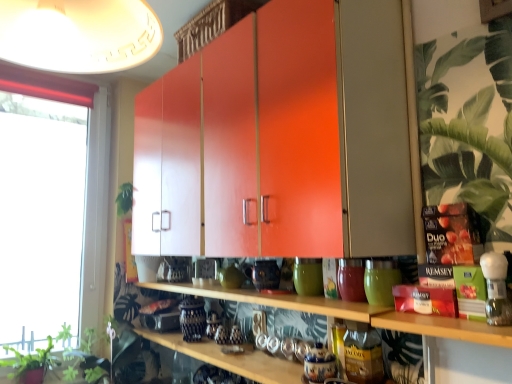
Question: Is green leafy plant at lower left, acting as the 3th plant starting from the top, located within green matte glass at center, acting as the 3th pottery starting from the back?

Choices:
 (A) no
 (B) yes

Answer: (A)

Question: Considering the relative sizes of green matte glass at center, which is the 3th pottery in left-to-right order, and green leafy plant at lower left, which is counted as the 3th plant, starting from the right, in the image provided, is green matte glass at center, which is the 3th pottery in left-to-right order, thinner than green leafy plant at lower left, which is counted as the 3th plant, starting from the right,?

Choices:
 (A) yes
 (B) no

Answer: (A)

Question: Can you confirm if green matte glass at center, the 1th pottery viewed from the right, is shorter than green leafy plant at lower left, which ranks as the first plant in bottom-to-top order?

Choices:
 (A) yes
 (B) no

Answer: (A)

Question: Can you confirm if green matte glass at center, acting as the 3th pottery starting from the back, is bigger than green leafy plant at lower left, which is counted as the 3th plant, starting from the right?

Choices:
 (A) no
 (B) yes

Answer: (A)

Question: Does green matte glass at center, acting as the 3th pottery starting from the back, have a smaller size compared to green leafy plant at lower left, which ranks as the 1th plant in left-to-right order?

Choices:
 (A) yes
 (B) no

Answer: (A)

Question: From a real-world perspective, is green matte glass at center, which is the 3th pottery in left-to-right order, under green leafy plant at lower left, acting as the 3th plant starting from the top?

Choices:
 (A) no
 (B) yes

Answer: (A)

Question: From a real-world perspective, is green matte vase at center, marked as the 3th pottery in a front-to-back arrangement, positioned over green matte plant at lower left, the 3th plant from the front, based on gravity?

Choices:
 (A) no
 (B) yes

Answer: (B)

Question: Can you confirm if green matte vase at center, which ranks as the first pottery in left-to-right order, is positioned to the right of green matte plant at lower left, the 3th plant from the front?

Choices:
 (A) no
 (B) yes

Answer: (B)

Question: Is green matte vase at center, which is counted as the first pottery, starting from the back, to the left of green matte plant at lower left, which appears as the 2th plant when viewed from the left, from the viewer's perspective?

Choices:
 (A) yes
 (B) no

Answer: (B)

Question: From a real-world perspective, is green matte vase at center, which is counted as the first pottery, starting from the back, physically below green matte plant at lower left, which appears as the 2th plant when viewed from the left?

Choices:
 (A) no
 (B) yes

Answer: (A)

Question: Considering the relative sizes of green matte vase at center, which ranks as the first pottery in left-to-right order, and green matte plant at lower left, which is counted as the second plant, starting from the top, in the image provided, is green matte vase at center, which ranks as the first pottery in left-to-right order, shorter than green matte plant at lower left, which is counted as the second plant, starting from the top,?

Choices:
 (A) no
 (B) yes

Answer: (B)

Question: Considering the relative sizes of green matte vase at center, the 3th pottery from the right, and green matte plant at lower left, which is counted as the second plant, starting from the top, in the image provided, is green matte vase at center, the 3th pottery from the right, smaller than green matte plant at lower left, which is counted as the second plant, starting from the top,?

Choices:
 (A) no
 (B) yes

Answer: (B)

Question: Can you confirm if green matte vase at center, which ranks as the first pottery in left-to-right order, is positioned to the right of transparent glass window at left?

Choices:
 (A) no
 (B) yes

Answer: (B)